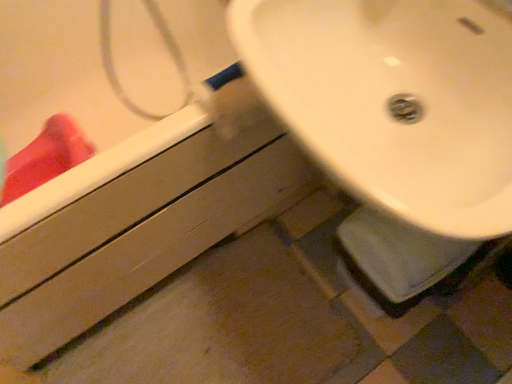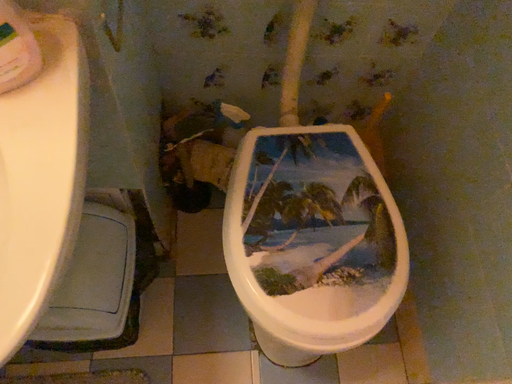
Question: How did the camera likely rotate when shooting the video?

Choices:
 (A) rotated left
 (B) rotated right

Answer: (B)